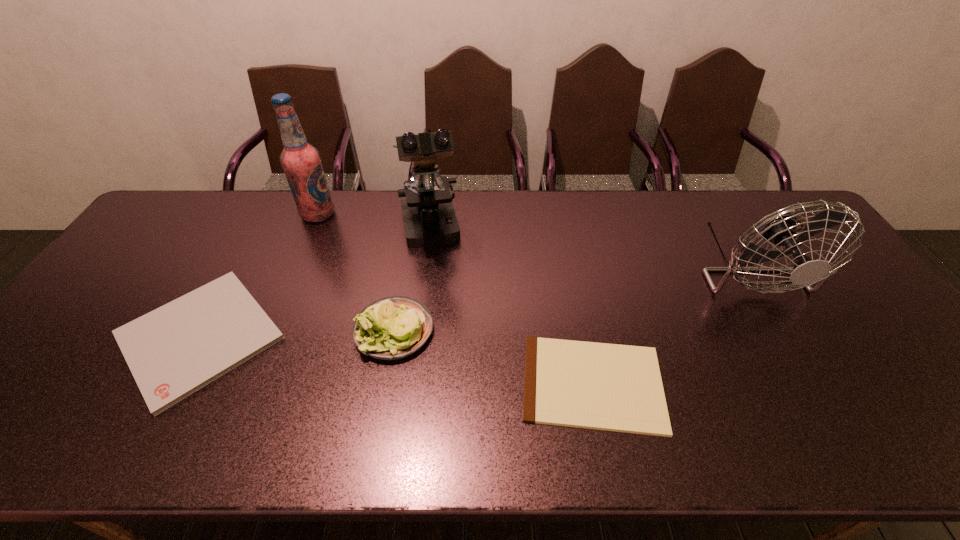
The width and height of the screenshot is (960, 540). In order to click on vacant point located 0.290m on the right of the alcohol in this screenshot , I will do `click(421, 214)`.

Where is `vacant space situated 0.070m on the front-facing side of the third tallest object`? vacant space situated 0.070m on the front-facing side of the third tallest object is located at coordinates point(790,340).

Locate an element on the screen. vacant area situated on the left of the lettuce is located at coordinates (235, 330).

The image size is (960, 540). I want to click on vacant space located 0.220m on the right of the second shortest object, so click(372, 336).

Image resolution: width=960 pixels, height=540 pixels. In order to click on blank space located on the right of the shortest object in this screenshot , I will do `click(717, 384)`.

Identify the location of microscope present at the far edge. This screenshot has width=960, height=540. (429, 218).

Find the location of a particular element. alcohol at the far edge is located at coordinates (301, 162).

In order to click on fan located at the far edge in this screenshot , I will do `click(780, 229)`.

The height and width of the screenshot is (540, 960). I want to click on object present at the near edge, so click(x=610, y=387).

Where is `object located at the left edge`? The height and width of the screenshot is (540, 960). object located at the left edge is located at coordinates (173, 351).